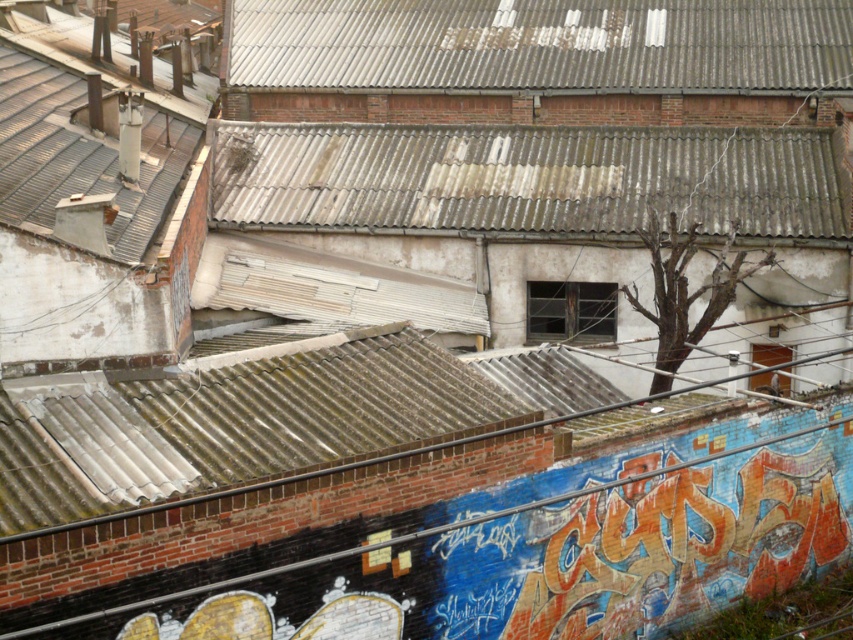
You are a painter standing on the rooftop and need to reach both the rusty corrugated metal roof at center and the rusty metal chimney at upper left to touch them up. Which object will require you to climb higher to reach its top?

The rusty metal chimney at upper left is taller than the rusty corrugated metal roof at center, so you will need to climb higher to reach its top.

You are an urban planner assessing the rooftop for potential solar panel installation. You notice the rusty corrugated metal roof at upper center and the rusty metal chimney at upper left. Which structure has a greater width, and would this affect the placement of solar panels?

The rusty corrugated metal roof at upper center has a greater width than the rusty metal chimney at upper left. This means the roof provides more space for solar panel placement, while the chimney may require more careful positioning to avoid obstruction.